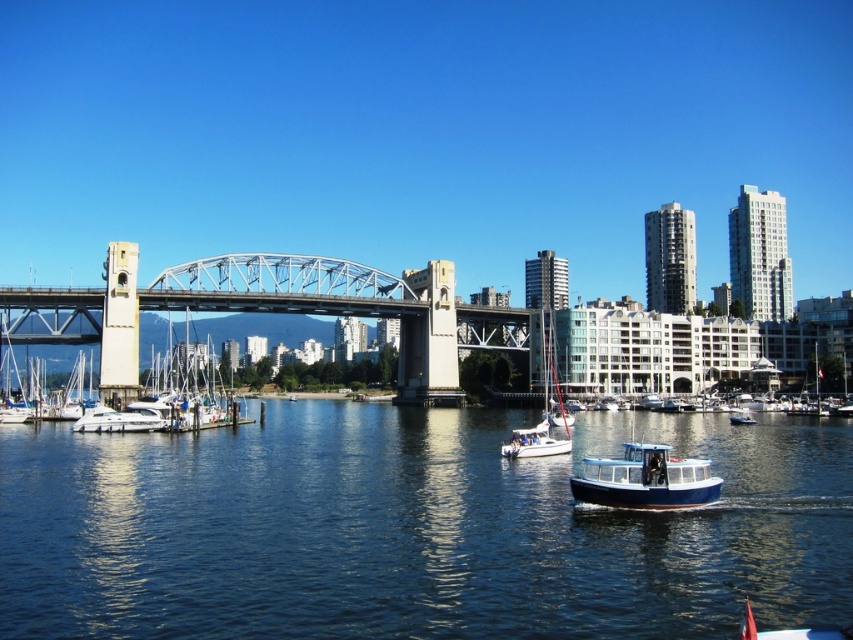
Question: Can you confirm if white sailboat at center is positioned to the right of white glossy sailboat at center?

Choices:
 (A) yes
 (B) no

Answer: (A)

Question: Which point is farther from the camera taking this photo?

Choices:
 (A) (682, 492)
 (B) (474, 324)

Answer: (B)

Question: Which point appears farthest from the camera in this image?

Choices:
 (A) (566, 445)
 (B) (555, 387)
 (C) (421, 275)
 (D) (79, 518)

Answer: (C)

Question: Does white sailboat at center appear over white glossy boat at lower left?

Choices:
 (A) yes
 (B) no

Answer: (A)

Question: Does white glossy boat at lower left appear on the left side of white glossy sailboat at center?

Choices:
 (A) yes
 (B) no

Answer: (A)

Question: Which of the following is the closest to the observer?

Choices:
 (A) 554,381
 (B) 503,442
 (C) 438,589

Answer: (C)